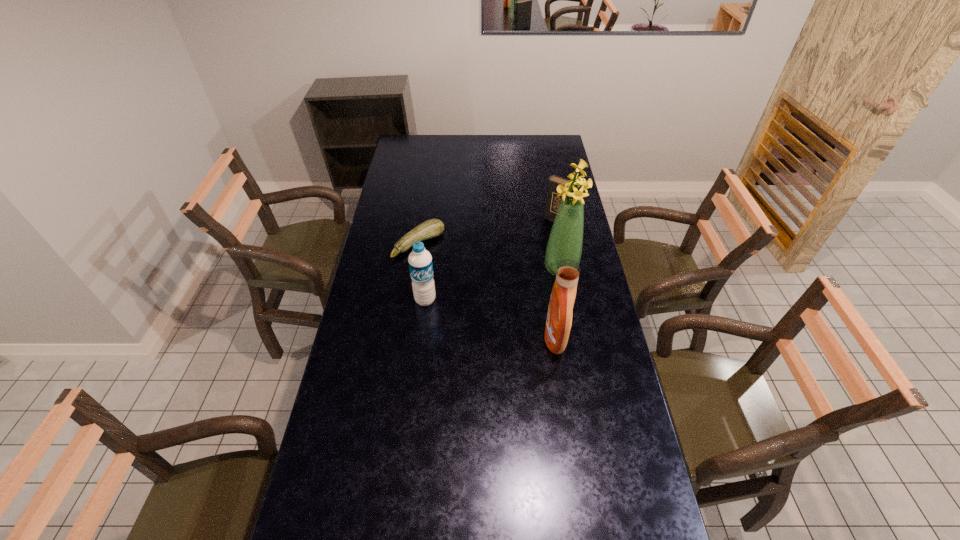
The width and height of the screenshot is (960, 540). I want to click on the second nearest object, so click(420, 263).

Where is `the third tallest object`? The height and width of the screenshot is (540, 960). the third tallest object is located at coordinates (420, 263).

Image resolution: width=960 pixels, height=540 pixels. I want to click on the nearest object, so click(559, 317).

You are a GUI agent. You are given a task and a screenshot of the screen. Output one action in this format:
    pyautogui.click(x=<x>, y=<y>)
    Task: Click on the fourth shortest object
    The image size is (960, 540).
    Given the screenshot: What is the action you would take?
    pyautogui.click(x=559, y=317)

The height and width of the screenshot is (540, 960). I want to click on zucchini, so click(x=431, y=228).

The image size is (960, 540). I want to click on the tallest object, so click(565, 241).

I want to click on diary, so pos(552,203).

Where is `free space located on the label of the third tallest object`? This screenshot has width=960, height=540. free space located on the label of the third tallest object is located at coordinates (421, 330).

Locate an element on the screen. vacant space situated 0.180m on the front-facing side of the fourth shortest object is located at coordinates (492, 338).

At what (x,y) coordinates should I click in order to perform the action: click on free location located 0.360m on the front-facing side of the fourth shortest object. Please return your answer as a coordinate pair (x, y). The image size is (960, 540). Looking at the image, I should click on (441, 338).